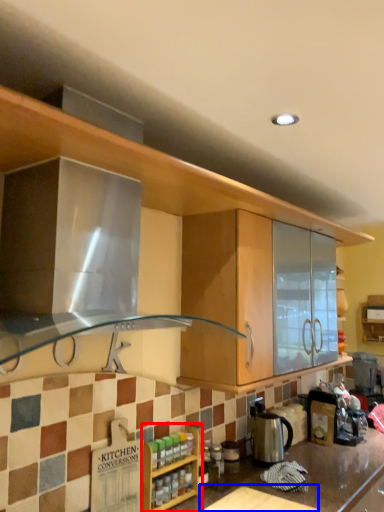
Question: Among these objects, which one is nearest to the camera, cabinetry (highlighted by a red box) or table (highlighted by a blue box)?

Choices:
 (A) cabinetry
 (B) table

Answer: (B)